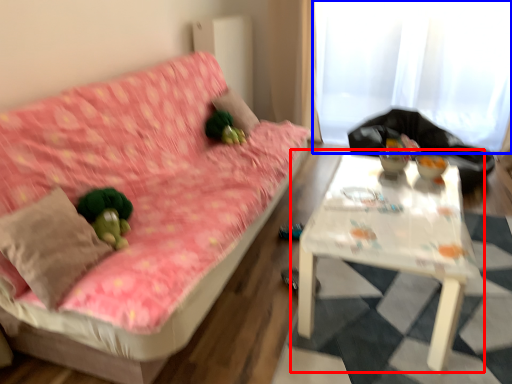
Question: Among these objects, which one is farthest to the camera, table (highlighted by a red box) or curtain (highlighted by a blue box)?

Choices:
 (A) table
 (B) curtain

Answer: (B)